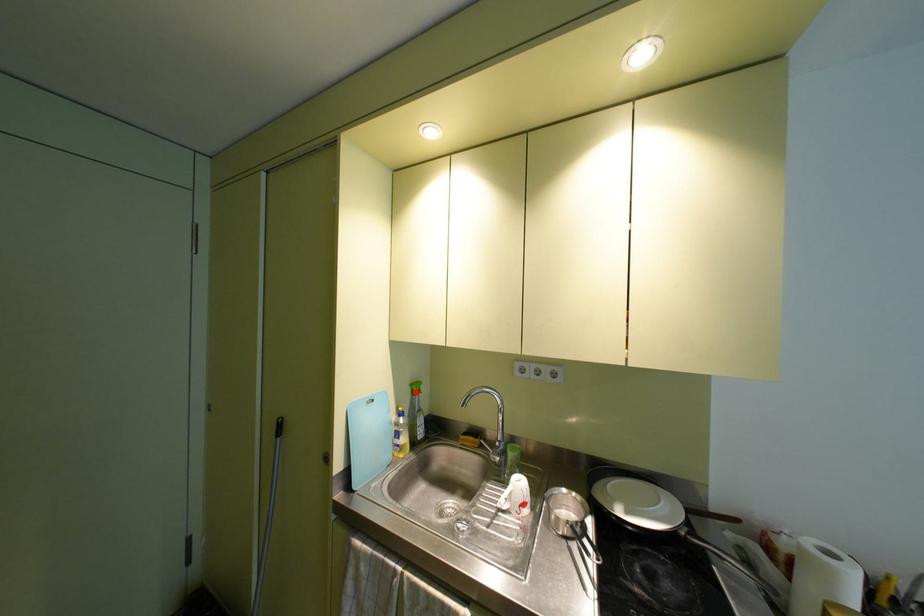
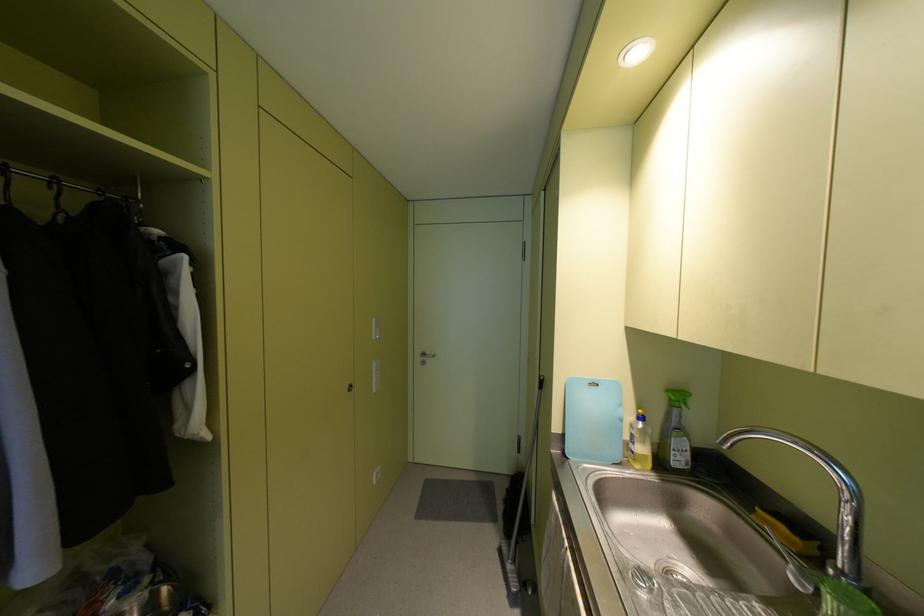
The point at the highlighted location is marked in the first image. Where is the corresponding point in the second image?

(675, 403)